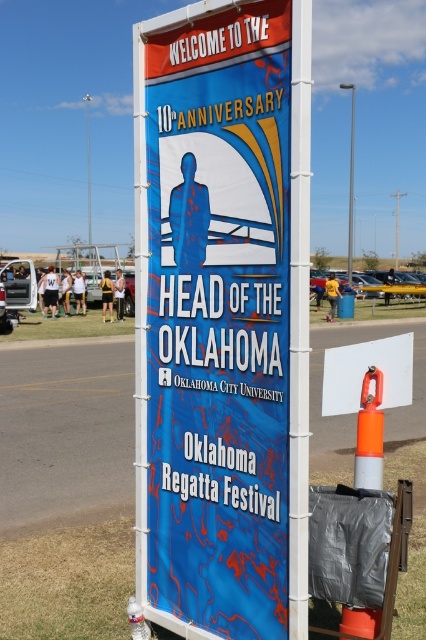
Question: Which object is positioned closest to the blue vinyl banner at center?

Choices:
 (A) white plastic pole at upper center
 (B) orange reflective traffic cone at lower right
 (C) metallic pole at center

Answer: (B)

Question: Can you confirm if blue vinyl banner at center is positioned above orange reflective traffic cone at lower right?

Choices:
 (A) yes
 (B) no

Answer: (A)

Question: Is blue vinyl banner at center below orange reflective traffic cone at lower right?

Choices:
 (A) yes
 (B) no

Answer: (B)

Question: Based on their relative distances, which object is nearer to the white plastic pole at upper center?

Choices:
 (A) metallic pole at center
 (B) blue vinyl banner at center
 (C) orange reflective traffic cone at lower right

Answer: (A)

Question: Which of the following is the closest to the observer?

Choices:
 (A) (89, 177)
 (B) (351, 280)

Answer: (B)

Question: Is orange reflective traffic cone at lower right wider than metallic pole at center?

Choices:
 (A) no
 (B) yes

Answer: (A)